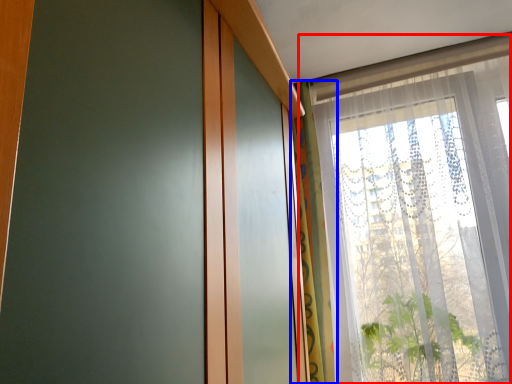
Question: Which of the following is the farthest to the observer, window (highlighted by a red box) or curtain (highlighted by a blue box)?

Choices:
 (A) window
 (B) curtain

Answer: (B)